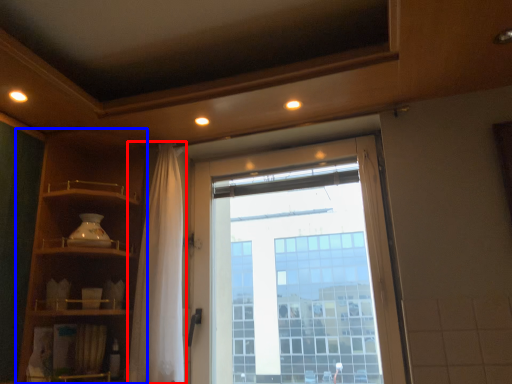
Question: Which object is further to the camera taking this photo, shower curtain (highlighted by a red box) or shelf (highlighted by a blue box)?

Choices:
 (A) shower curtain
 (B) shelf

Answer: (A)